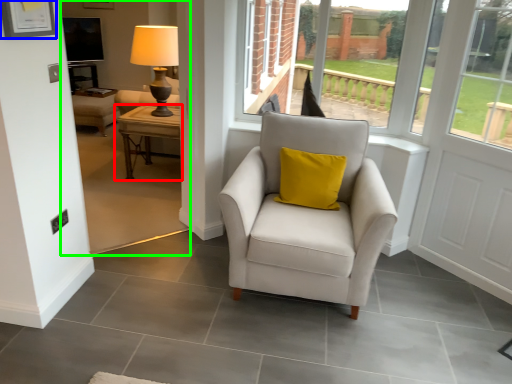
Question: Estimate the real-world distances between objects in this image. Which object is farther from table (highlighted by a red box), picture frame (highlighted by a blue box) or backyard (highlighted by a green box)?

Choices:
 (A) picture frame
 (B) backyard

Answer: (A)